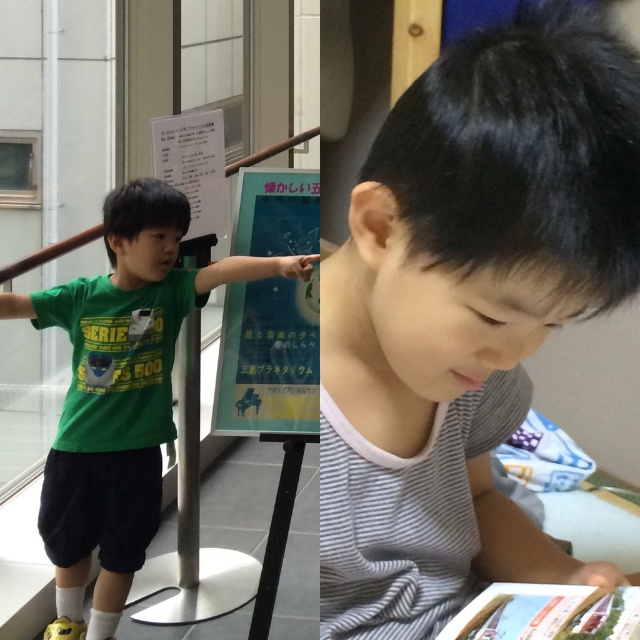
Is gray striped shirt at center taller than blue paper poster at center?

In fact, gray striped shirt at center may be shorter than blue paper poster at center.

Can you confirm if gray striped shirt at center is wider than blue paper poster at center?

In fact, gray striped shirt at center might be narrower than blue paper poster at center.

Is point (515, 250) closer to camera compared to point (282, 292)?

Yes, it is in front of point (282, 292).

At what (x,y) coordinates should I click in order to perform the action: click on gray striped shirt at center. Please return your answer as a coordinate pair (x, y). The image size is (640, 640). Looking at the image, I should click on (467, 310).

Which of these two, gray striped shirt at center or green matte shirt at center, stands shorter?

With less height is gray striped shirt at center.

Who is more distant from viewer, [353,614] or [164,310]?

Positioned behind is point [164,310].

Where is `gray striped shirt at center`? gray striped shirt at center is located at coordinates (467, 310).

Can you confirm if green matte shirt at center is positioned above blue paper poster at center?

No.

This screenshot has width=640, height=640. Describe the element at coordinates (120, 394) in the screenshot. I see `green matte shirt at center` at that location.

You are a GUI agent. You are given a task and a screenshot of the screen. Output one action in this format:
    pyautogui.click(x=<x>, y=<y>)
    Task: Click on the green matte shirt at center
    
    Given the screenshot: What is the action you would take?
    pyautogui.click(x=120, y=394)